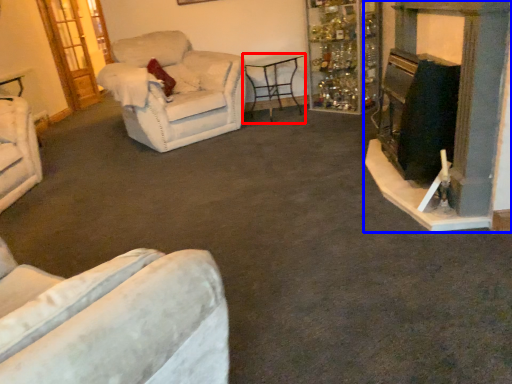
Question: Which object is closer to the camera taking this photo, table (highlighted by a red box) or fireplace (highlighted by a blue box)?

Choices:
 (A) table
 (B) fireplace

Answer: (B)